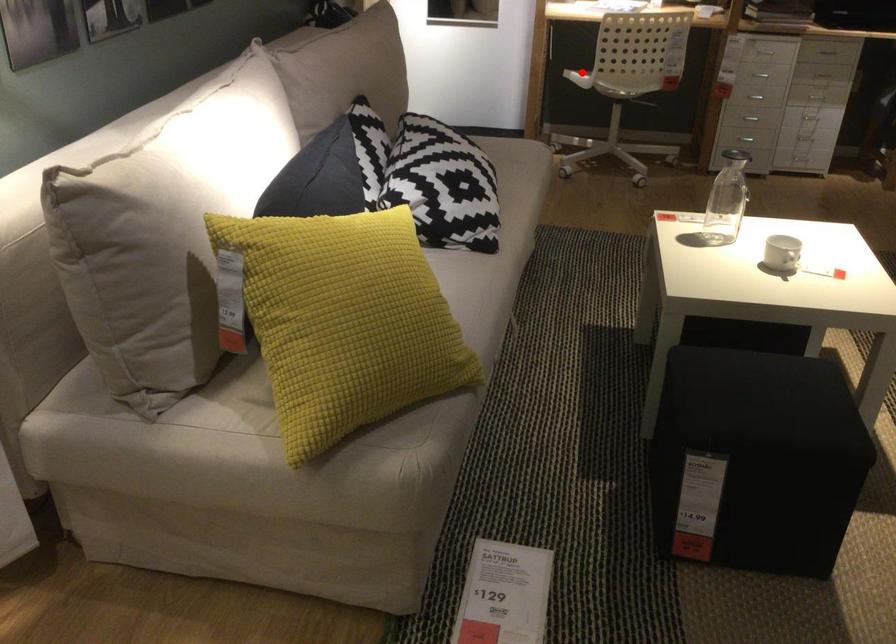
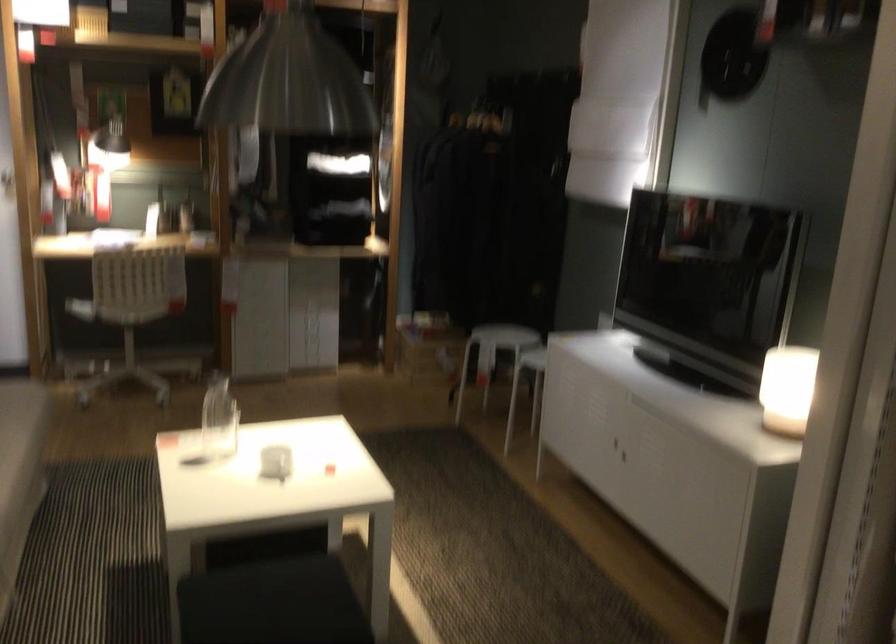
The point at the highlighted location is marked in the first image. Where is the corresponding point in the second image?

(80, 308)